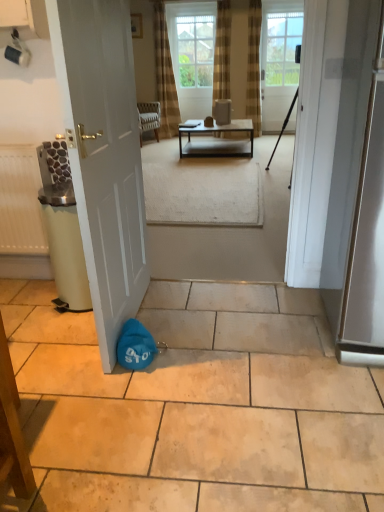
The image size is (384, 512). What are the coordinates of `empty space that is to the right of white matte door at left, which is counted as the second door, starting from the top` in the screenshot? It's located at (206, 324).